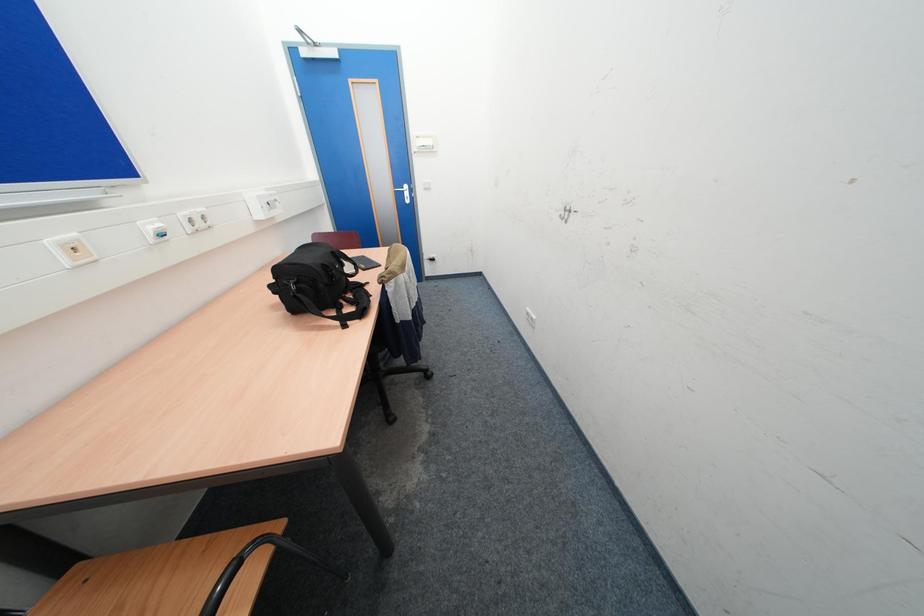
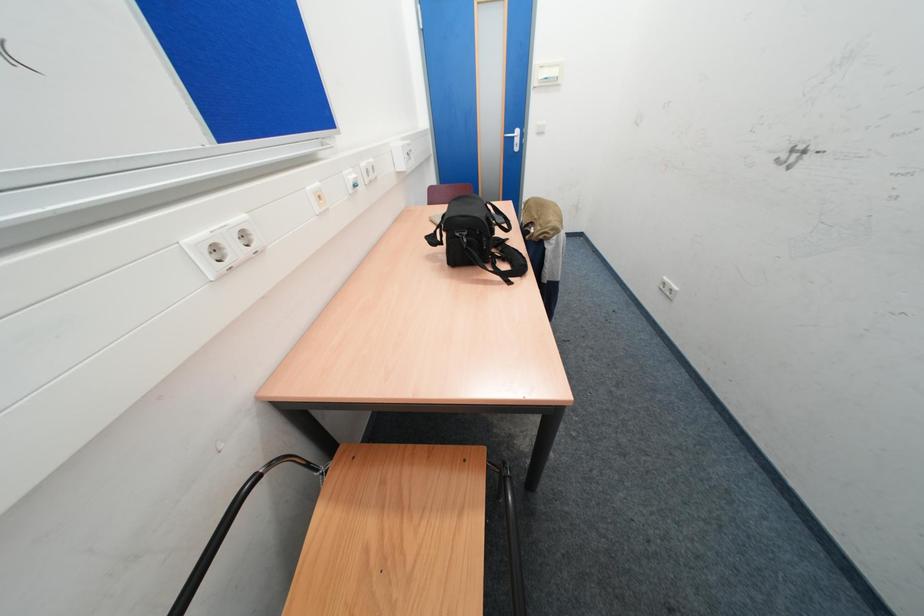
Question: The camera is either moving clockwise (left) or counter-clockwise (right) around the object. The first image is from the beginning of the video and the second image is from the end. Is the camera moving left or right when shooting the video?

Choices:
 (A) Left
 (B) Right

Answer: (B)